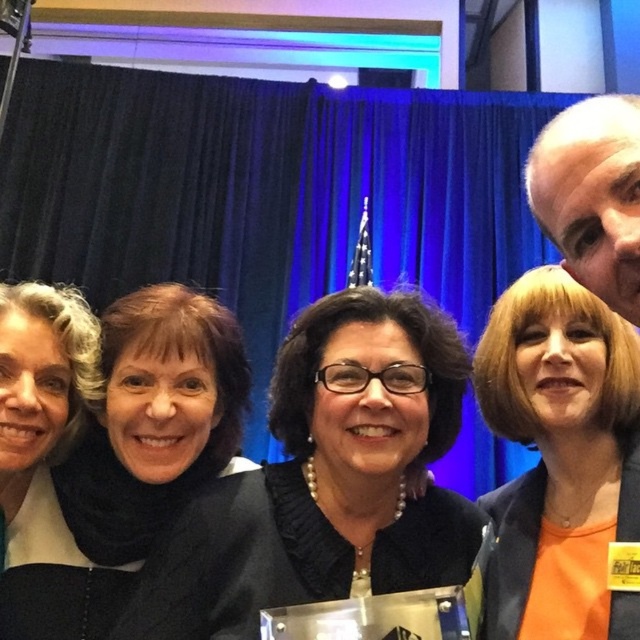
The width and height of the screenshot is (640, 640). Describe the element at coordinates (128, 464) in the screenshot. I see `black matte scarf at upper left` at that location.

Which is below, black matte scarf at upper left or orange matte jacket at upper right?

black matte scarf at upper left is lower down.

Does point (4, 579) come behind point (516, 419)?

That is True.

This screenshot has width=640, height=640. I want to click on black matte scarf at upper left, so click(128, 464).

The image size is (640, 640). In order to click on orange matte jacket at upper right in this screenshot , I will do `click(561, 458)`.

Between orange matte jacket at upper right and matte black jacket at left, which one is positioned lower?

orange matte jacket at upper right

Does point (579, 424) come in front of point (12, 490)?

Yes, it is.

Identify the location of orange matte jacket at upper right. (561, 458).

In the scene shown: Is black matte scarf at upper left below matte black jacket at left?

Indeed, black matte scarf at upper left is positioned under matte black jacket at left.

Does point (113, 529) come behind point (83, 310)?

That is False.

This screenshot has height=640, width=640. Identify the location of black matte scarf at upper left. (128, 464).